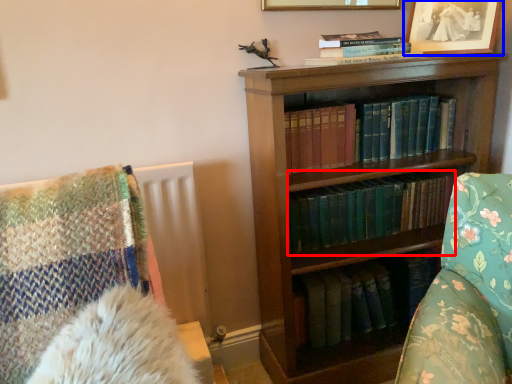
Question: Among these objects, which one is farthest to the camera, book (highlighted by a red box) or picture frame (highlighted by a blue box)?

Choices:
 (A) book
 (B) picture frame

Answer: (A)